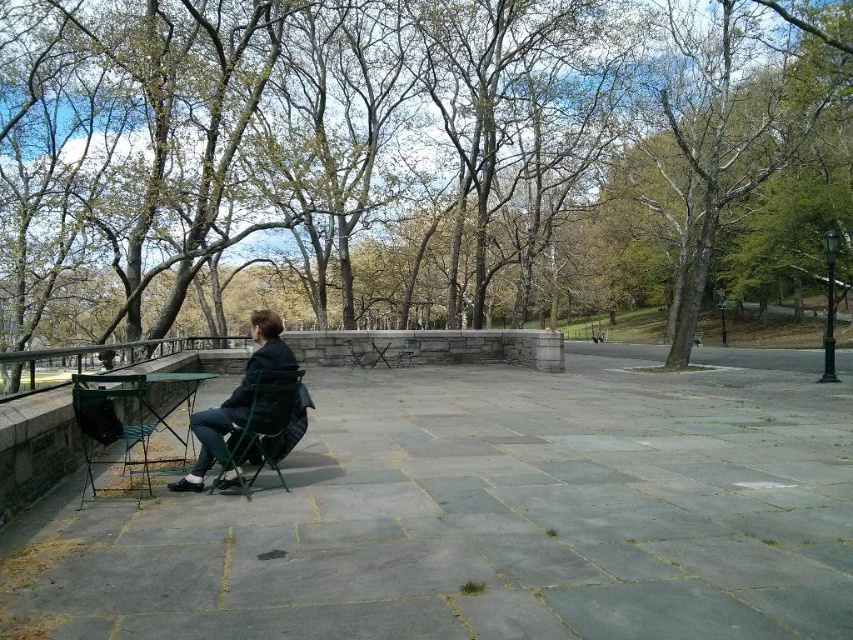
Question: Does green fabric chair at left appear on the right side of green fabric chair at center?

Choices:
 (A) no
 (B) yes

Answer: (B)

Question: Observing the image, what is the correct spatial positioning of green fabric chair at left in reference to metallic green chair at lower left?

Choices:
 (A) left
 (B) right

Answer: (B)

Question: Which of these objects is positioned closest to the dark gray fabric jacket at center-left?

Choices:
 (A) green fabric chair at left
 (B) green fabric chair at center
 (C) metallic green chair at lower left
 (D) brown leafy tree at center

Answer: (A)

Question: Considering the real-world distances, which object is closest to the green fabric chair at center?

Choices:
 (A) green fabric chair at left
 (B) brown leafy tree at center

Answer: (B)

Question: Estimate the real-world distances between objects in this image. Which object is farther from the green fabric chair at left?

Choices:
 (A) brown leafy tree at center
 (B) green fabric chair at center

Answer: (B)

Question: Does brown leafy tree at center have a larger size compared to metallic green chair at lower left?

Choices:
 (A) yes
 (B) no

Answer: (A)